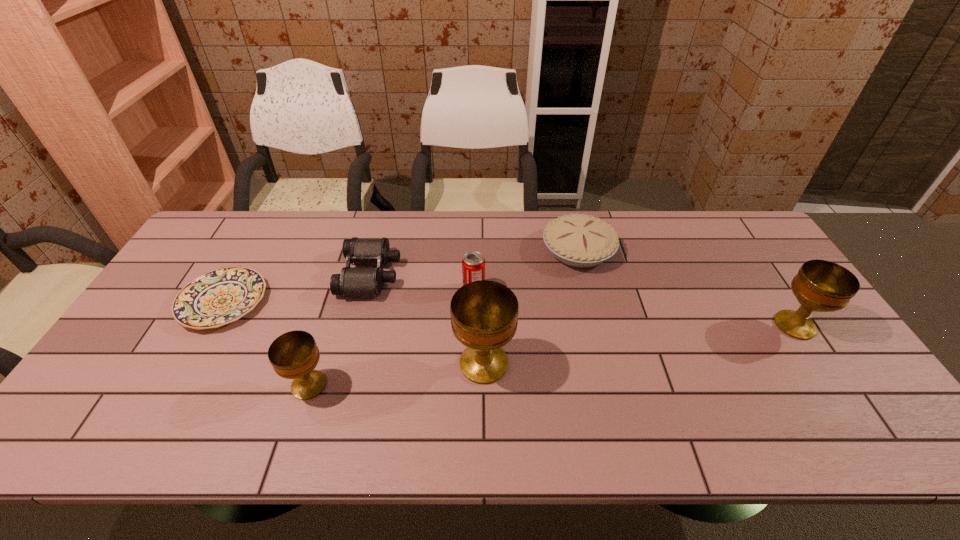
Image resolution: width=960 pixels, height=540 pixels. Identify the location of unoccupied area between the sixth object from left to right and the second chalice from left to right. (531, 307).

Locate an element on the screen. unoccupied position between the rightmost chalice and the soda can is located at coordinates (635, 307).

At what (x,y) coordinates should I click in order to perform the action: click on vacant space that is in between the plate and the shortest chalice. Please return your answer as a coordinate pair (x, y). This screenshot has height=540, width=960. Looking at the image, I should click on (266, 343).

Locate an element on the screen. Image resolution: width=960 pixels, height=540 pixels. vacant area between the plate and the binoculars is located at coordinates (297, 288).

This screenshot has height=540, width=960. In order to click on object that stands as the sixth closest to the pie in this screenshot , I will do (221, 296).

Locate which object is the closest to the second object from right to left. Please provide its 2D coordinates. Your answer should be formatted as a tuple, i.e. [(x, y)], where the tuple contains the x and y coordinates of a point satisfying the conditions above.

[(473, 263)]

Locate an element on the screen. chalice that stands as the closest to the second chalice from right to left is located at coordinates (294, 355).

At what (x,y) coordinates should I click in order to perform the action: click on the third closest chalice relative to the binoculars. Please return your answer as a coordinate pair (x, y). Looking at the image, I should click on pyautogui.click(x=822, y=286).

Locate an element on the screen. This screenshot has width=960, height=540. blank space that satisfies the following two spatial constraints: 1. on the front side of the second object from right to left; 2. through the eyepieces of the binoculars is located at coordinates pos(585,274).

Where is `vacant space that satisfies the following two spatial constraints: 1. on the front side of the pie; 2. through the eyepieces of the binoculars`? vacant space that satisfies the following two spatial constraints: 1. on the front side of the pie; 2. through the eyepieces of the binoculars is located at coordinates (585, 274).